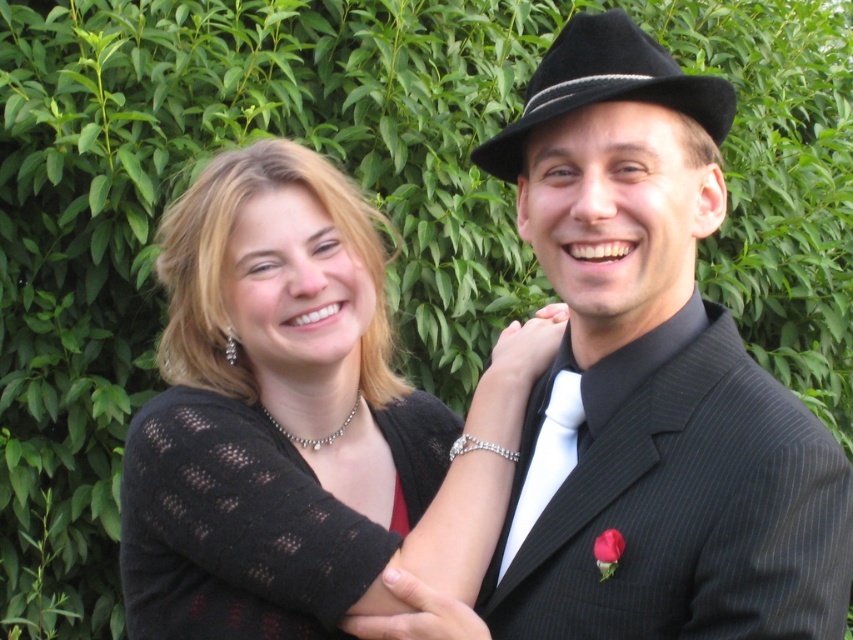
Who is higher up, black pinstripe suit at center or black knitted sweater at center?

black pinstripe suit at center is higher up.

Between point (685, 115) and point (155, 541), which one is positioned in front?

Point (685, 115) is more forward.

Find the location of a particular element. black pinstripe suit at center is located at coordinates tap(653, 384).

Does black pinstripe suit at center have a greater width compared to knitted black sweater at center?

No.

Does black pinstripe suit at center have a smaller size compared to knitted black sweater at center?

Yes, black pinstripe suit at center is smaller than knitted black sweater at center.

Where is `black pinstripe suit at center`? This screenshot has height=640, width=853. black pinstripe suit at center is located at coordinates (653, 384).

The width and height of the screenshot is (853, 640). What are the coordinates of `black pinstripe suit at center` in the screenshot? It's located at (653, 384).

Who is taller, black pinstripe suit at center or white satin tie at center?

With more height is black pinstripe suit at center.

Find the location of a particular element. black pinstripe suit at center is located at coordinates (653, 384).

Where is `black pinstripe suit at center`? black pinstripe suit at center is located at coordinates (653, 384).